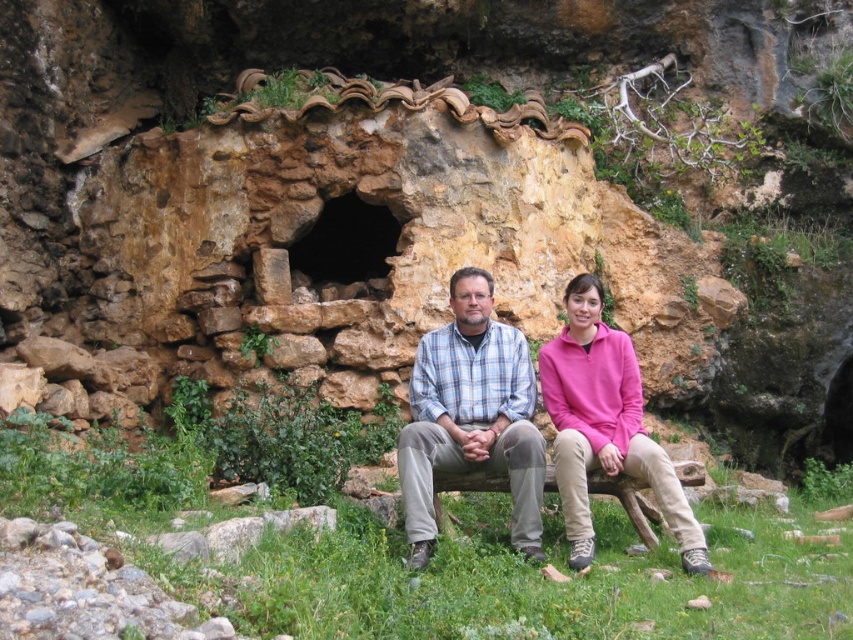
Is pink fleece at center bigger than brown wooden bench at center?

Yes, pink fleece at center is bigger than brown wooden bench at center.

Who is shorter, pink fleece at center or brown wooden bench at center?

Standing shorter between the two is brown wooden bench at center.

You are a GUI agent. You are given a task and a screenshot of the screen. Output one action in this format:
    pyautogui.click(x=<x>, y=<y>)
    Task: Click on the pink fleece at center
    The width and height of the screenshot is (853, 640).
    Given the screenshot: What is the action you would take?
    pyautogui.click(x=604, y=426)

Locate an element on the screen. This screenshot has height=640, width=853. pink fleece at center is located at coordinates [x=604, y=426].

Does plaid fabric shirt at center have a smaller size compared to brown stone cave at center?

No.

Does point (515, 448) come in front of point (306, 262)?

Yes, point (515, 448) is closer to viewer.

What are the coordinates of `plaid fabric shirt at center` in the screenshot? It's located at (471, 417).

You are a GUI agent. You are given a task and a screenshot of the screen. Output one action in this format:
    pyautogui.click(x=<x>, y=<y>)
    Task: Click on the plaid fabric shirt at center
    This screenshot has height=640, width=853.
    Given the screenshot: What is the action you would take?
    click(471, 417)

Who is positioned more to the right, plaid fabric shirt at center or brown wooden bench at center?

brown wooden bench at center

Identify the location of plaid fabric shirt at center. pyautogui.click(x=471, y=417).

Based on the photo, who is more forward, (490, 388) or (640, 528)?

Point (640, 528) is more forward.

At what (x,y) coordinates should I click in order to perform the action: click on plaid fabric shirt at center. Please return your answer as a coordinate pair (x, y). Looking at the image, I should click on (471, 417).